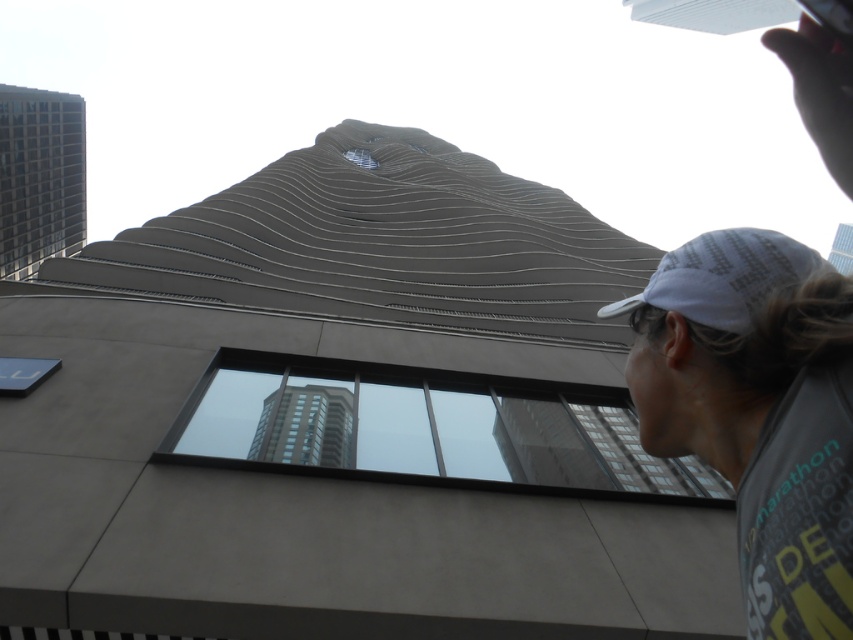
Does transparent glass window at center have a lesser height compared to white fabric baseball cap at upper right?

Incorrect, transparent glass window at center's height does not fall short of white fabric baseball cap at upper right's.

Between transparent glass window at center and white fabric baseball cap at upper right, which one appears on the left side from the viewer's perspective?

From the viewer's perspective, transparent glass window at center appears more on the left side.

This screenshot has width=853, height=640. Describe the element at coordinates (424, 428) in the screenshot. I see `transparent glass window at center` at that location.

Locate an element on the screen. This screenshot has width=853, height=640. transparent glass window at center is located at coordinates (424, 428).

Does white fabric cap at upper right have a greater width compared to white fabric baseball cap at upper right?

Yes, white fabric cap at upper right is wider than white fabric baseball cap at upper right.

The image size is (853, 640). Identify the location of white fabric cap at upper right. (757, 410).

Is metallic glass skyscraper at left to the right of white fabric baseball cap at upper right from the viewer's perspective?

In fact, metallic glass skyscraper at left is to the left of white fabric baseball cap at upper right.

Where is `metallic glass skyscraper at left`? The width and height of the screenshot is (853, 640). metallic glass skyscraper at left is located at coordinates (39, 177).

The image size is (853, 640). Describe the element at coordinates (39, 177) in the screenshot. I see `metallic glass skyscraper at left` at that location.

This screenshot has width=853, height=640. Find the location of `metallic glass skyscraper at left`. metallic glass skyscraper at left is located at coordinates (39, 177).